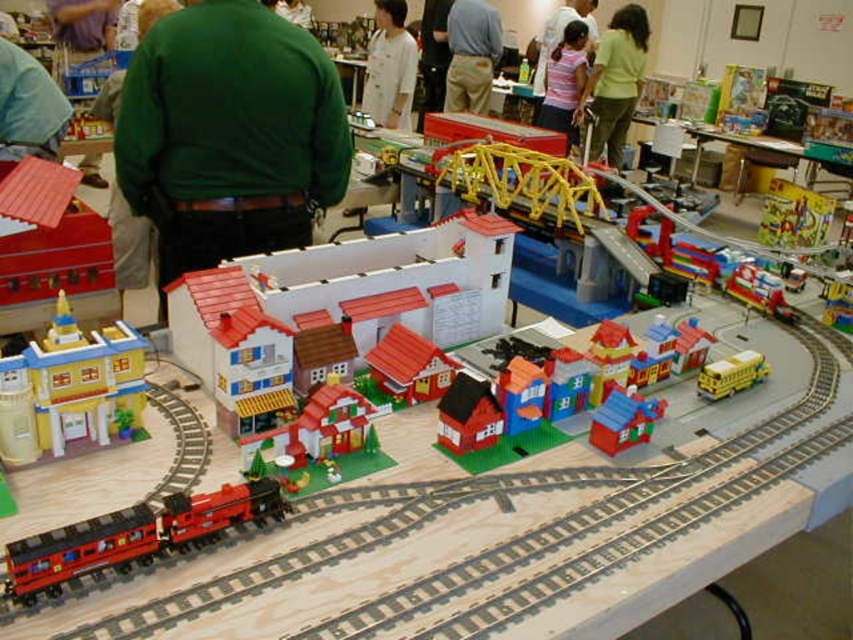
This screenshot has height=640, width=853. In order to click on white smooth shirt at center in this screenshot , I will do `click(390, 67)`.

Is point (370, 99) closer to viewer compared to point (631, 422)?

No, it is behind (631, 422).

What do you see at coordinates (390, 67) in the screenshot?
I see `white smooth shirt at center` at bounding box center [390, 67].

Locate an element on the screen. white smooth shirt at center is located at coordinates (390, 67).

Looking at this image, between green matte sweater at upper left and blue plastic house at center, which one appears on the left side from the viewer's perspective?

From the viewer's perspective, green matte sweater at upper left appears more on the left side.

Does green matte sweater at upper left appear over blue plastic house at center?

Correct, green matte sweater at upper left is located above blue plastic house at center.

What do you see at coordinates (229, 134) in the screenshot? This screenshot has height=640, width=853. I see `green matte sweater at upper left` at bounding box center [229, 134].

Identify the location of green matte sweater at upper left. The height and width of the screenshot is (640, 853). [x=229, y=134].

From the picture: Does green matte sweater at upper left have a smaller size compared to shiny red train at lower left?

No, green matte sweater at upper left is not smaller than shiny red train at lower left.

Between green matte sweater at upper left and shiny red train at lower left, which one is positioned lower?

shiny red train at lower left is lower down.

Locate an element on the screen. Image resolution: width=853 pixels, height=640 pixels. green matte sweater at upper left is located at coordinates (229, 134).